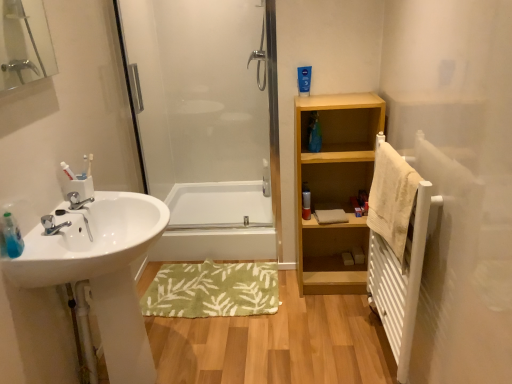
Question: Is white glossy bathtub at center a part of matte silver canister at center?

Choices:
 (A) yes
 (B) no

Answer: (B)

Question: Is matte silver canister at center thinner than white glossy bathtub at center?

Choices:
 (A) yes
 (B) no

Answer: (A)

Question: Is matte silver canister at center further to camera compared to white glossy bathtub at center?

Choices:
 (A) no
 (B) yes

Answer: (A)

Question: Is matte silver canister at center shorter than white glossy bathtub at center?

Choices:
 (A) yes
 (B) no

Answer: (A)

Question: Considering the relative sizes of matte silver canister at center and white glossy bathtub at center in the image provided, is matte silver canister at center taller than white glossy bathtub at center?

Choices:
 (A) yes
 (B) no

Answer: (B)

Question: Is white glossy sink at left situated inside transparent glass shower door at center or outside?

Choices:
 (A) inside
 (B) outside

Answer: (B)

Question: Considering the positions of point (50, 276) and point (254, 188), is point (50, 276) closer or farther from the camera than point (254, 188)?

Choices:
 (A) farther
 (B) closer

Answer: (B)

Question: Is white glossy sink at left bigger or smaller than transparent glass shower door at center?

Choices:
 (A) big
 (B) small

Answer: (A)

Question: Is white glossy sink at left wider or thinner than transparent glass shower door at center?

Choices:
 (A) wide
 (B) thin

Answer: (A)

Question: Is light wood shelf at center right in front of or behind white glossy sink at left in the image?

Choices:
 (A) front
 (B) behind

Answer: (B)

Question: Is light wood shelf at center right to the left or to the right of white glossy sink at left in the image?

Choices:
 (A) left
 (B) right

Answer: (B)

Question: From a real-world perspective, is light wood shelf at center right above or below white glossy sink at left?

Choices:
 (A) below
 (B) above

Answer: (B)

Question: In terms of height, does light wood shelf at center right look taller or shorter compared to white glossy sink at left?

Choices:
 (A) short
 (B) tall

Answer: (B)

Question: Visually, is silver metallic faucet at sink left positioned to the left or to the right of beige textured towel at right?

Choices:
 (A) right
 (B) left

Answer: (B)

Question: Looking at their shapes, would you say silver metallic faucet at sink left is wider or thinner than beige textured towel at right?

Choices:
 (A) wide
 (B) thin

Answer: (A)